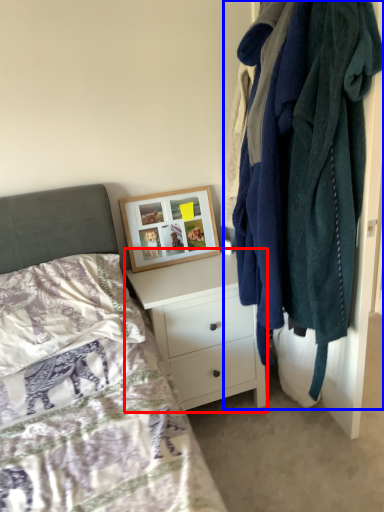
Question: Among these objects, which one is farthest to the camera, chest of drawers (highlighted by a red box) or closet (highlighted by a blue box)?

Choices:
 (A) chest of drawers
 (B) closet

Answer: (A)